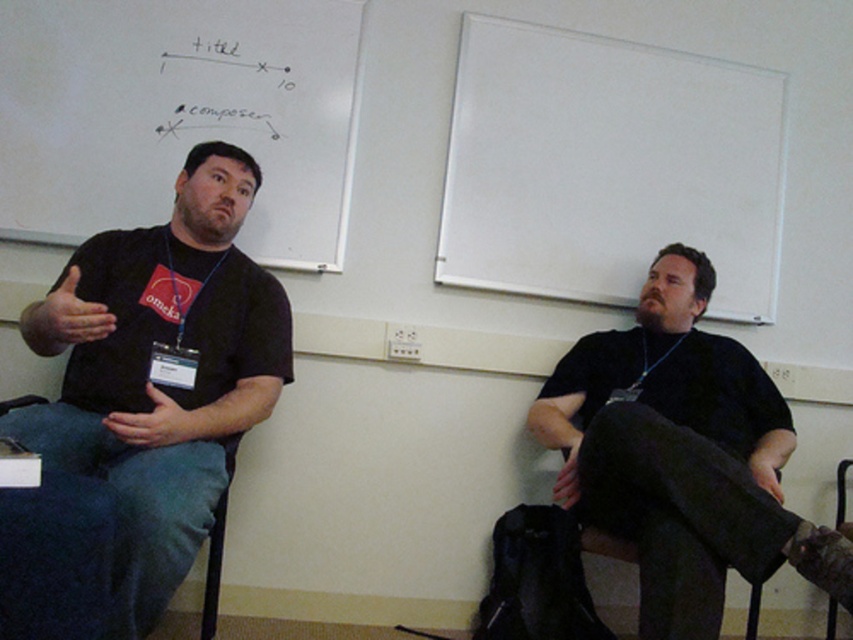
Is white matte board at upper center wider than black paper at upper left?

Yes, white matte board at upper center is wider than black paper at upper left.

Which is above, white matte board at upper center or black paper at upper left?

black paper at upper left is above.

Which is in front, point (706, 83) or point (187, 116)?

Point (187, 116) is more forward.

Find the location of `white matte board at upper center`. white matte board at upper center is located at coordinates (608, 168).

Is black matte shirt at center to the left of black paper at upper left from the viewer's perspective?

In fact, black matte shirt at center is to the right of black paper at upper left.

Can you confirm if black matte shirt at center is positioned below black paper at upper left?

Yes, black matte shirt at center is below black paper at upper left.

Where is `black matte shirt at center`? Image resolution: width=853 pixels, height=640 pixels. black matte shirt at center is located at coordinates (672, 449).

Does white matte board at upper center have a lesser width compared to black matte shirt at center?

In fact, white matte board at upper center might be wider than black matte shirt at center.

Measure the distance from white matte board at upper center to black matte shirt at center.

white matte board at upper center is 20.51 inches from black matte shirt at center.

Which is in front, point (579, 118) or point (640, 397)?

Point (640, 397)

The width and height of the screenshot is (853, 640). Identify the location of white matte board at upper center. (608, 168).